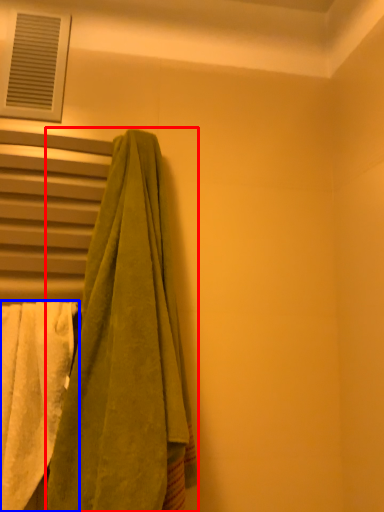
Question: Which of the following is the farthest to the observer, towel (highlighted by a red box) or towel (highlighted by a blue box)?

Choices:
 (A) towel
 (B) towel

Answer: (B)